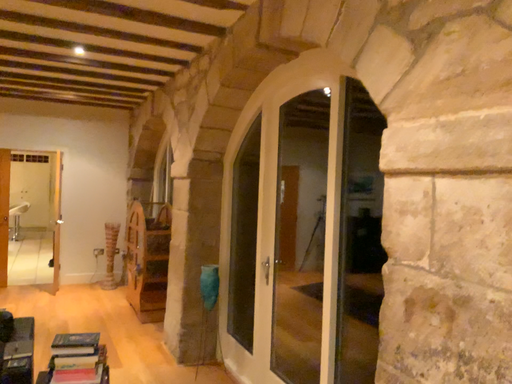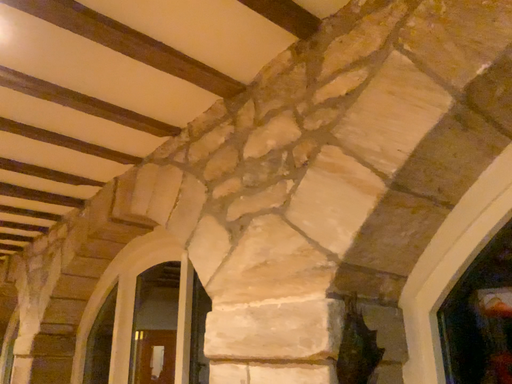
Question: Which way did the camera rotate in the video?

Choices:
 (A) rotated left
 (B) rotated right

Answer: (B)